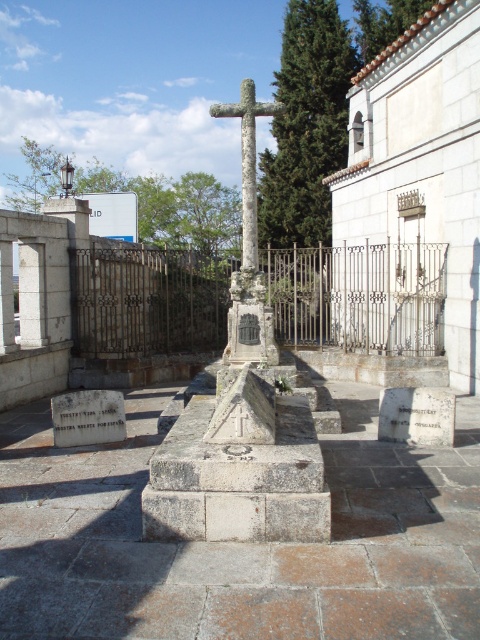
Question: Among these objects, which one is nearest to the camera?

Choices:
 (A) stone cross at center
 (B) white stone gravestone at center

Answer: (B)

Question: Can you confirm if stone cross at center is positioned to the right of white stone gravestone at center?

Choices:
 (A) yes
 (B) no

Answer: (B)

Question: Does stone cross at center appear on the left side of white stone gravestone at center?

Choices:
 (A) no
 (B) yes

Answer: (B)

Question: Among these objects, which one is farthest from the camera?

Choices:
 (A) stone cross at center
 (B) white stone gravestone at center

Answer: (A)

Question: Where is stone cross at center located in relation to white stone gravestone at center in the image?

Choices:
 (A) right
 (B) left

Answer: (B)

Question: Which of the following is the farthest from the observer?

Choices:
 (A) (406, 426)
 (B) (252, 172)

Answer: (B)